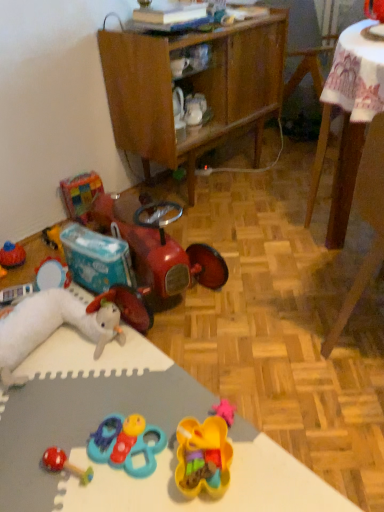
Where is `free space between rubberized red car at lower left, placed as the fourth toy when sorted from right to left, and plastic toy at center`? This screenshot has width=384, height=512. free space between rubberized red car at lower left, placed as the fourth toy when sorted from right to left, and plastic toy at center is located at coordinates (241, 368).